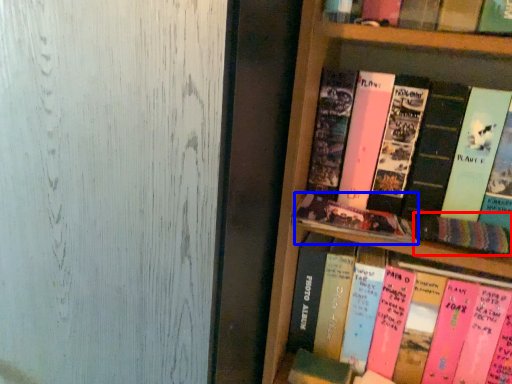
Question: Which object is closer to the camera taking this photo, book (highlighted by a red box) or book (highlighted by a blue box)?

Choices:
 (A) book
 (B) book

Answer: (A)